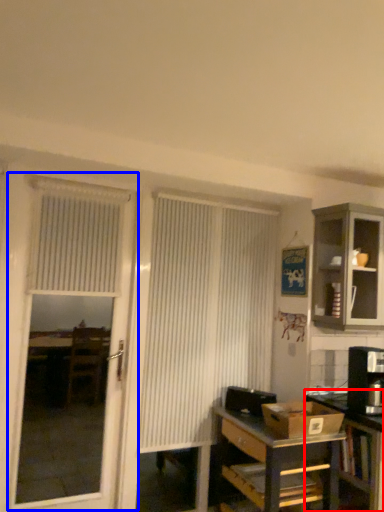
Question: Among these objects, which one is farthest to the camera, table (highlighted by a red box) or screen door (highlighted by a blue box)?

Choices:
 (A) table
 (B) screen door

Answer: (B)